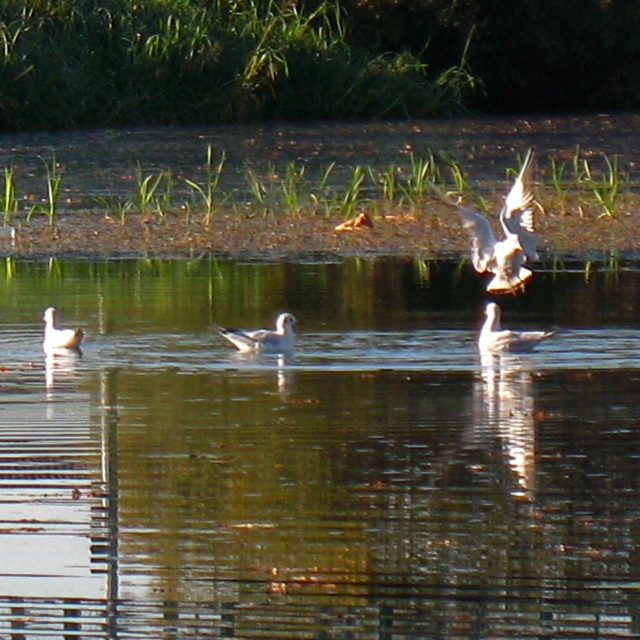
Question: Which object is farther from the camera taking this photo?

Choices:
 (A) white matte seagull at center
 (B) white feathered bird at upper right
 (C) white matte duck at center

Answer: (A)

Question: Considering the relative positions of clear water at center and white matte seagull at center in the image provided, where is clear water at center located with respect to white matte seagull at center?

Choices:
 (A) right
 (B) left

Answer: (A)

Question: Does clear water at center have a lesser width compared to white matte seagull at center?

Choices:
 (A) no
 (B) yes

Answer: (A)

Question: From the image, what is the correct spatial relationship of white feathered bird at upper right in relation to white matte duck at left?

Choices:
 (A) left
 (B) right

Answer: (B)

Question: Which point is closer to the camera?

Choices:
 (A) (168, 477)
 (B) (518, 193)
 (C) (554, 332)

Answer: (B)

Question: Among these points, which one is nearest to the camera?

Choices:
 (A) (51, 314)
 (B) (180, 589)

Answer: (B)